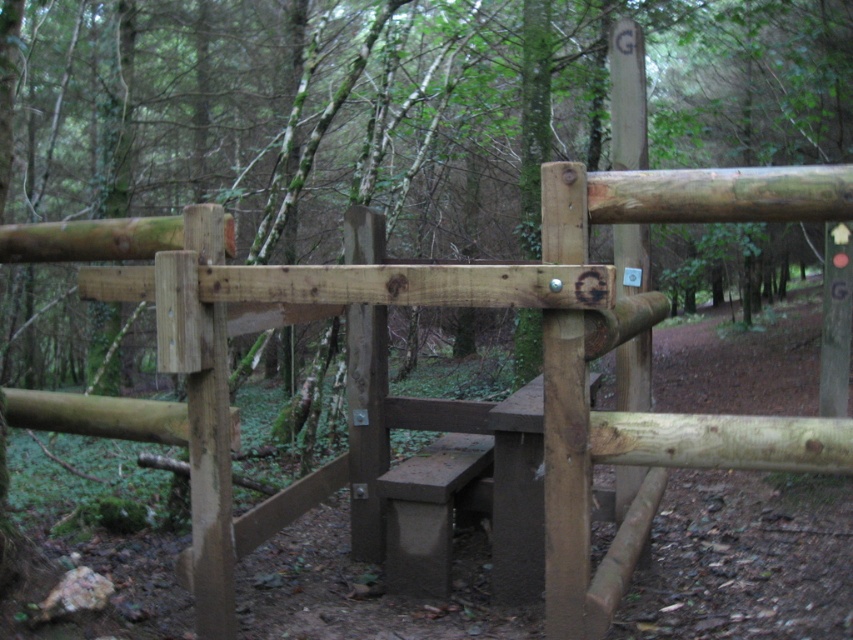
Based on the photo, you are a painter with a 1.5 meter wide canvas. You want to paint the natural wood gate at center and the concrete bench at center in the scene. Can your canvas accommodate both objects side by side without overlapping?

The natural wood gate at center might be wider than concrete bench at center. If the gate is wider than the bench, the combined width of both objects could exceed the 1.5 meter canvas. Therefore, it is uncertain if they can fit without overlapping.

You are a painter who needs to decide which object to paint first. You can only paint one object at a time. Since the natural wood gate at center is taller than the concrete bench at center, which object should you paint first if you want to start with the taller one?

You should paint the natural wood gate at center first because it is taller than the concrete bench at center.